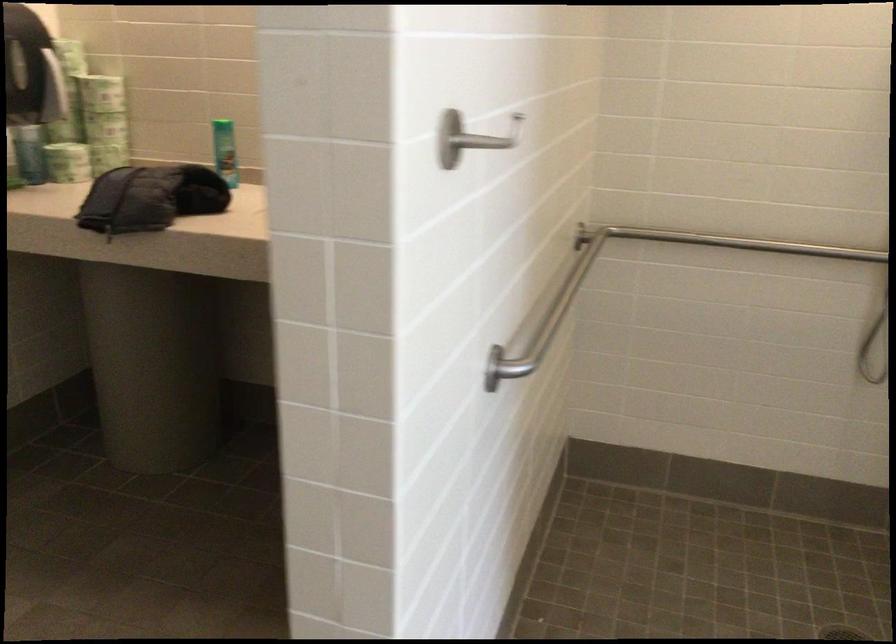
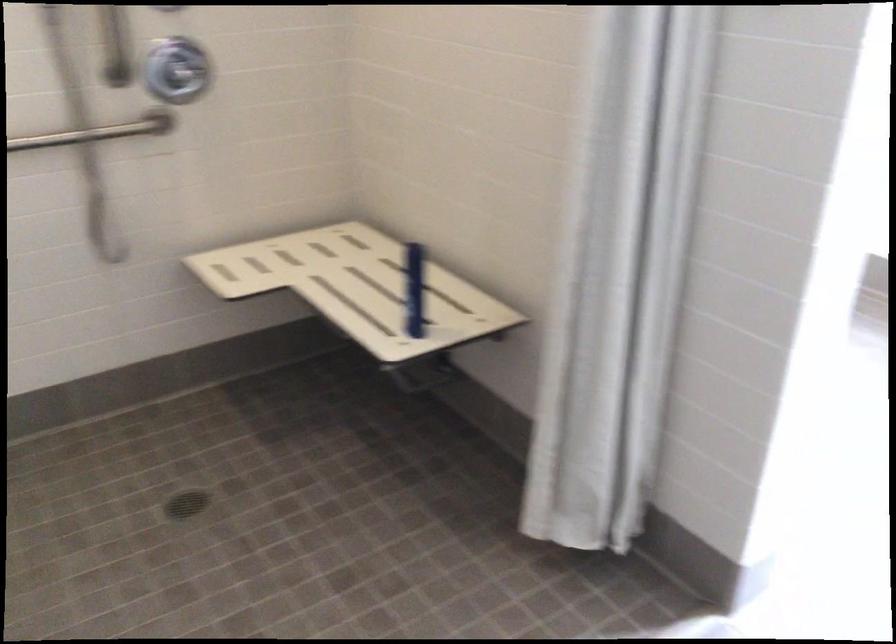
Question: Based on the continuous images, in which direction is the camera rotating? Reply with the corresponding letter.

Choices:
 (A) Left
 (B) Right
 (C) Up
 (D) Down

Answer: (B)